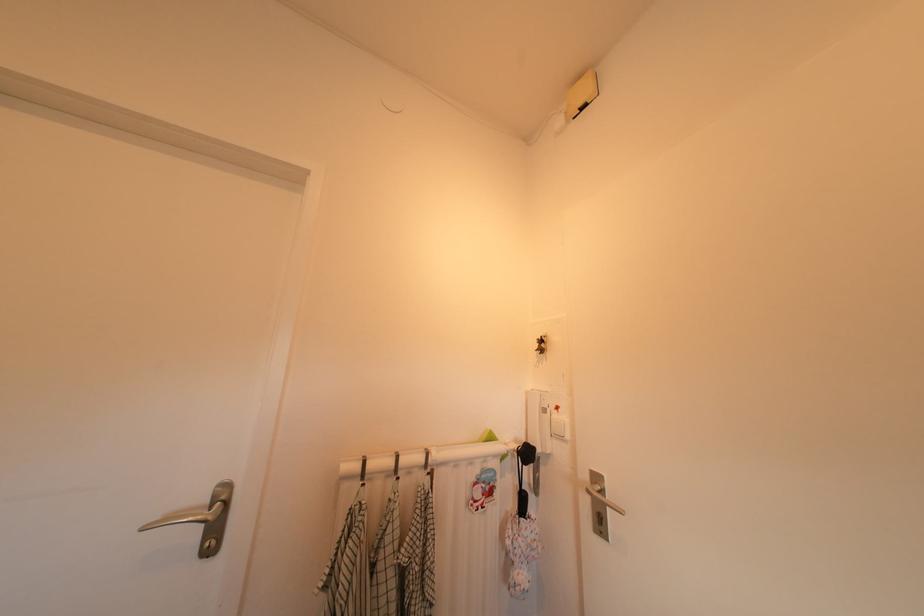
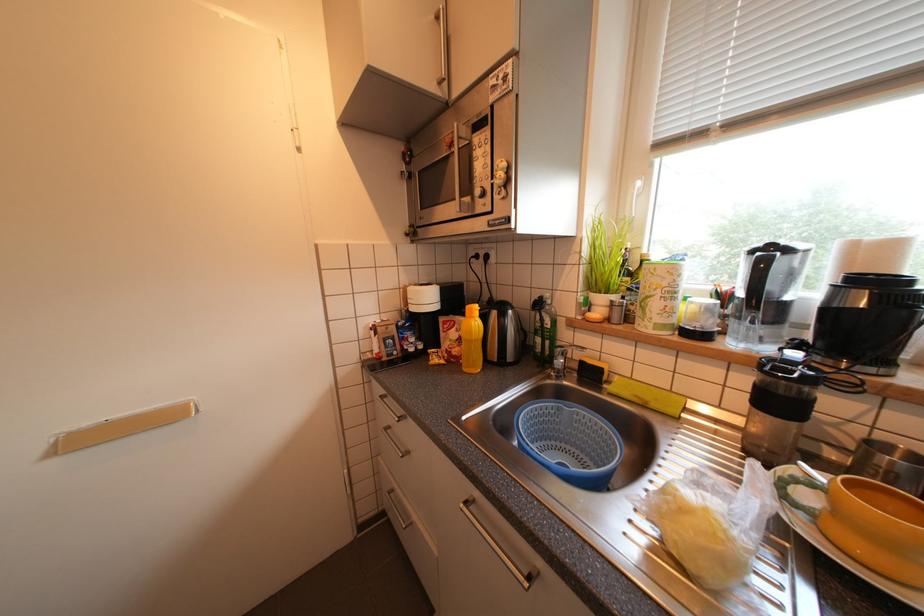
Question: The first image is from the beginning of the video and the second image is from the end. How did the camera likely rotate when shooting the video?

Choices:
 (A) Left
 (B) Right
 (C) Up
 (D) Down

Answer: (B)